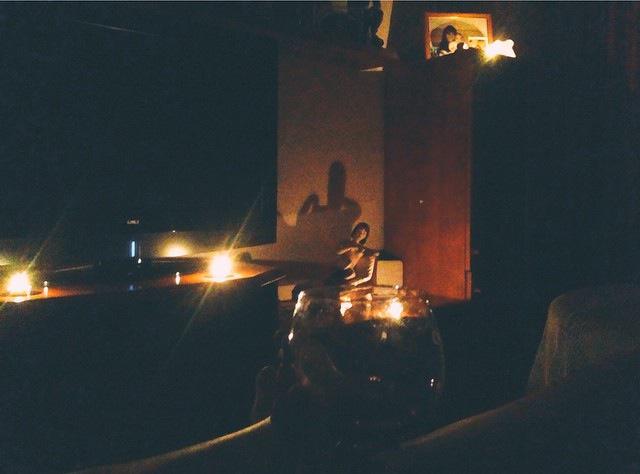
Locate an element on the screen. This screenshot has width=640, height=474. tea candle middle is located at coordinates (218, 263).